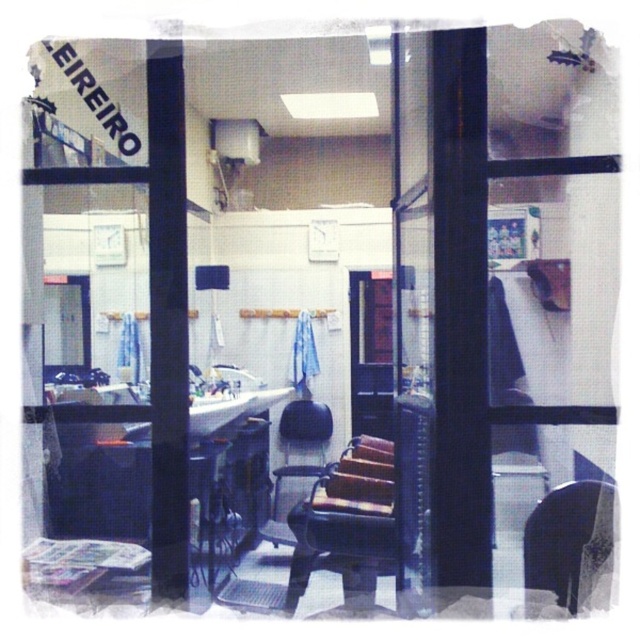
Question: Which point is closer to the camera?

Choices:
 (A) metallic black chair at center
 (B) black leather chair at lower right

Answer: (B)

Question: Among these objects, which one is nearest to the camera?

Choices:
 (A) black leather chair at lower right
 (B) black leather chair at center
 (C) metallic black chair at center

Answer: (A)

Question: Is metallic black chair at center bigger than black leather chair at center?

Choices:
 (A) no
 (B) yes

Answer: (B)

Question: From the image, what is the correct spatial relationship of black leather chair at lower right in relation to black leather chair at center?

Choices:
 (A) below
 (B) above

Answer: (A)

Question: Is the position of metallic black chair at center more distant than that of black leather chair at lower right?

Choices:
 (A) yes
 (B) no

Answer: (A)

Question: Which object is the closest to the metallic black chair at center?

Choices:
 (A) black leather chair at center
 (B) black leather chair at lower right

Answer: (A)